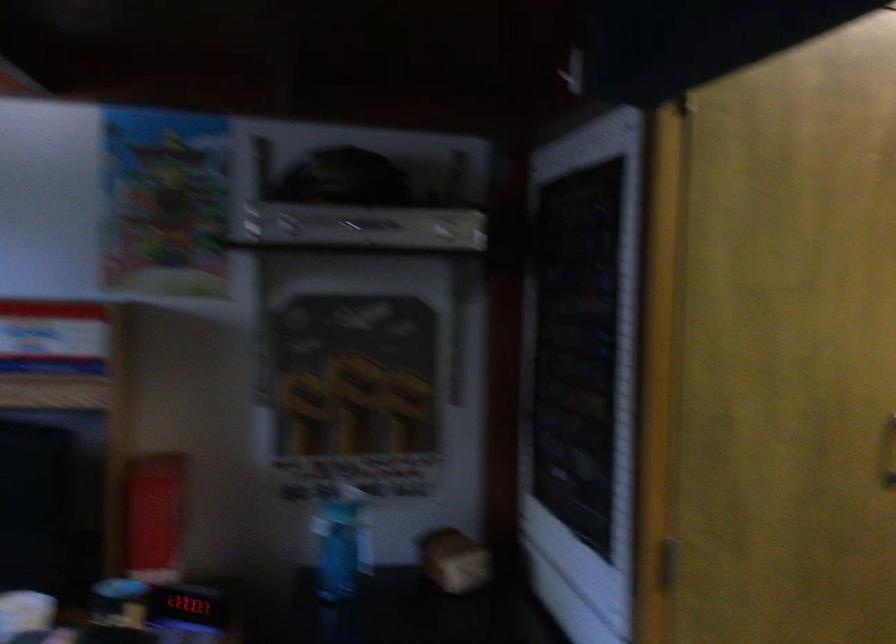
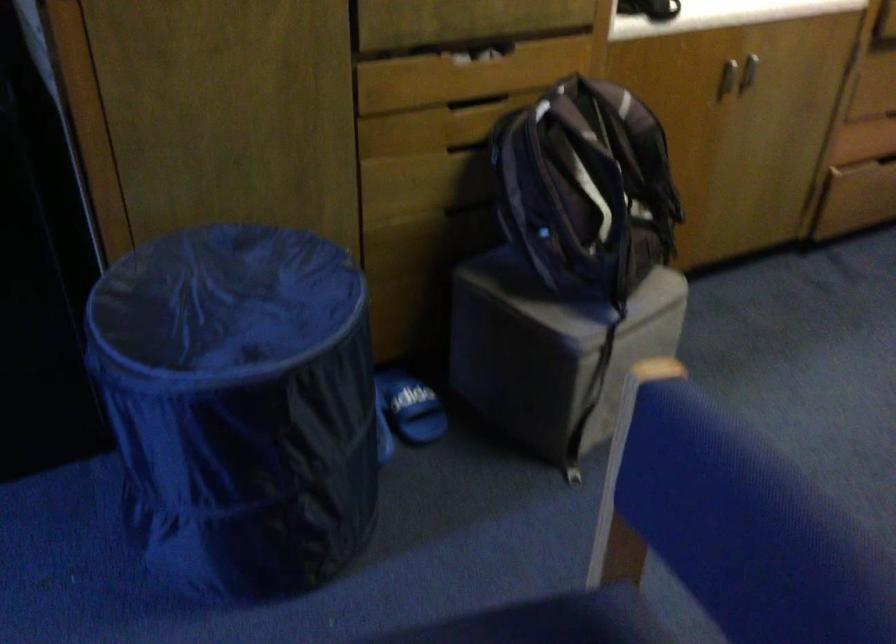
In the scene shown: The images are taken continuously from a first-person perspective. In which direction is your viewpoint rotating?

The camera rotated toward right-down.